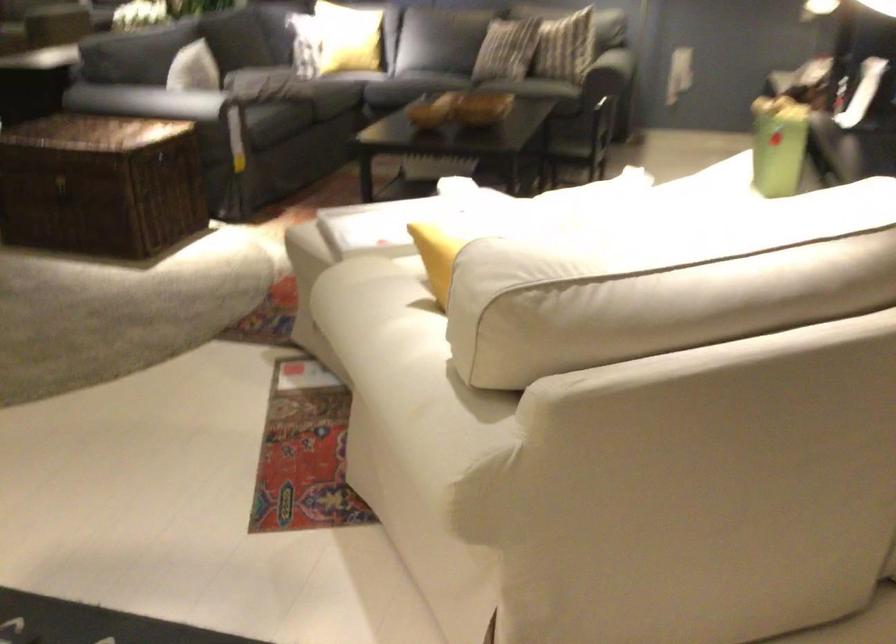
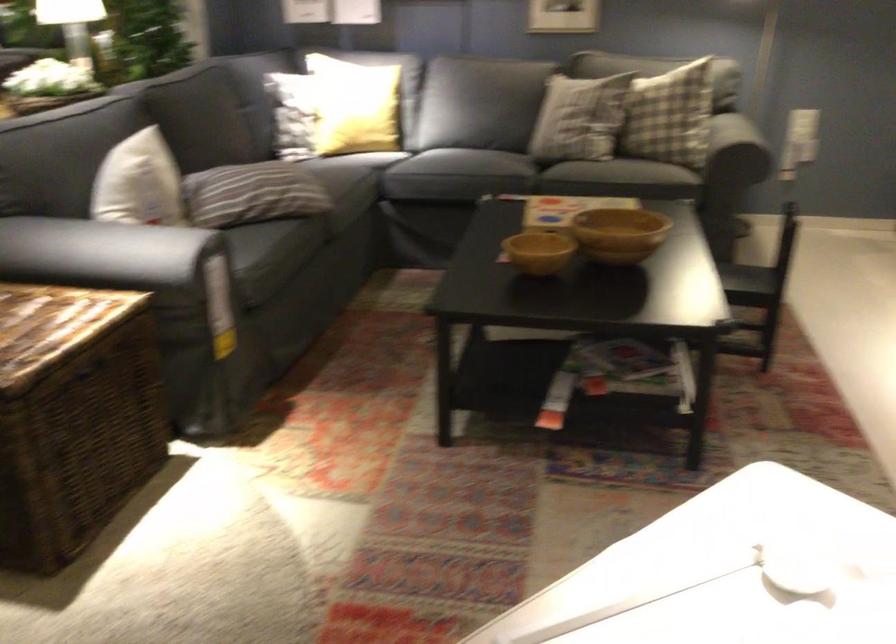
The point at (x=271, y=79) is marked in the first image. Where is the corresponding point in the second image?

(261, 194)